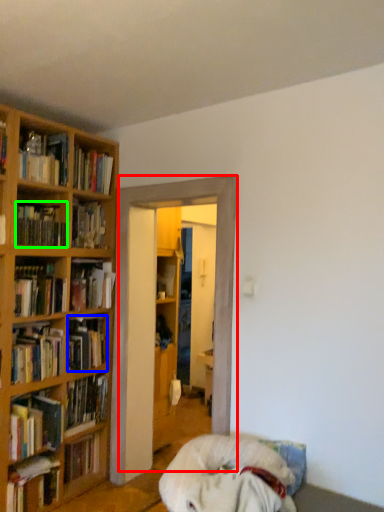
Question: Which object is the farthest from entertainment center (highlighted by a red box)? Choose among these: book (highlighted by a blue box) or book (highlighted by a green box).

Choices:
 (A) book
 (B) book

Answer: (B)